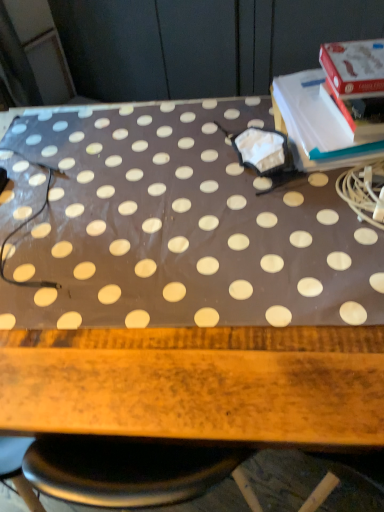
Question: Should I look upward or downward to see white polka dot fabric at center?

Choices:
 (A) down
 (B) up

Answer: (A)

Question: Considering the relative sizes of white polka dot fabric at center and white paper at upper right in the image provided, is white polka dot fabric at center bigger than white paper at upper right?

Choices:
 (A) yes
 (B) no

Answer: (A)

Question: Is white paper at upper right surrounded by white polka dot fabric at center?

Choices:
 (A) no
 (B) yes

Answer: (A)

Question: Is white polka dot fabric at center to the left of white paper at upper right from the viewer's perspective?

Choices:
 (A) no
 (B) yes

Answer: (B)

Question: From a real-world perspective, is white polka dot fabric at center beneath white paper at upper right?

Choices:
 (A) yes
 (B) no

Answer: (A)

Question: From the image's perspective, is white polka dot fabric at center on top of white paper at upper right?

Choices:
 (A) no
 (B) yes

Answer: (A)

Question: Is white polka dot fabric at center smaller than white paper at upper right?

Choices:
 (A) no
 (B) yes

Answer: (A)

Question: Is white paper at upper right located outside white polka dot fabric at center?

Choices:
 (A) yes
 (B) no

Answer: (A)

Question: Does white paper at upper right have a greater height compared to white polka dot fabric at center?

Choices:
 (A) yes
 (B) no

Answer: (B)

Question: Is the depth of white paper at upper right less than that of white polka dot fabric at center?

Choices:
 (A) no
 (B) yes

Answer: (A)

Question: Is white paper at upper right turned away from white polka dot fabric at center?

Choices:
 (A) no
 (B) yes

Answer: (A)

Question: Does white paper at upper right have a larger size compared to white polka dot fabric at center?

Choices:
 (A) no
 (B) yes

Answer: (A)

Question: From a real-world perspective, is white paper at upper right located higher than white polka dot fabric at center?

Choices:
 (A) yes
 (B) no

Answer: (A)

Question: Is white polka dot fabric at center bigger or smaller than white paper at upper right?

Choices:
 (A) small
 (B) big

Answer: (B)